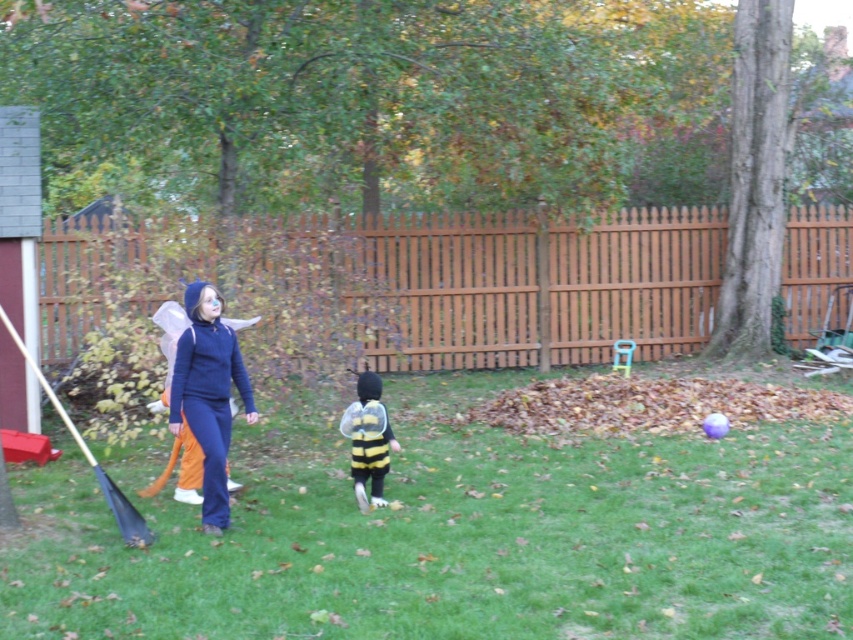
Is point (178, 620) positioned behind point (364, 500)?

No, (178, 620) is closer to viewer.

Who is taller, green grass at center or yellow and black fabric bee costume at center?

With more height is yellow and black fabric bee costume at center.

Is point (183, 632) closer to camera compared to point (375, 378)?

That is True.

Find the location of a particular element. The image size is (853, 640). green grass at center is located at coordinates (456, 536).

Who is shorter, green grass at center or black plastic shovel at left?

With less height is green grass at center.

At what (x,y) coordinates should I click in order to perform the action: click on green grass at center. Please return your answer as a coordinate pair (x, y). The image size is (853, 640). Looking at the image, I should click on (456, 536).

Does blue fleece jacket at center appear on the right side of black plastic shovel at left?

Yes, blue fleece jacket at center is to the right of black plastic shovel at left.

Who is shorter, blue fleece jacket at center or black plastic shovel at left?

black plastic shovel at left is shorter.

Which is in front, point (173, 424) or point (67, 419)?

Positioned in front is point (67, 419).

I want to click on blue fleece jacket at center, so click(x=207, y=394).